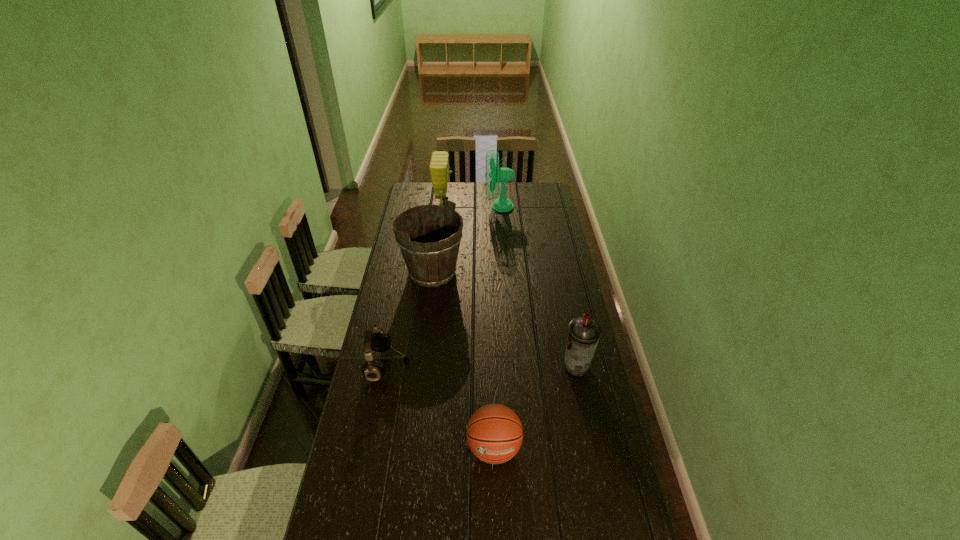
This screenshot has width=960, height=540. I want to click on free location located 0.050m on the face of the sponge, so click(x=462, y=203).

Locate an element on the screen. The width and height of the screenshot is (960, 540). free space located 0.360m on the left of the rightmost object is located at coordinates (471, 366).

The width and height of the screenshot is (960, 540). Identify the location of blank space located with the microphone on the side of the headset. (449, 366).

The height and width of the screenshot is (540, 960). Identify the location of vacant space located 0.180m on the logo side of the basketball. (496, 536).

Locate an element on the screen. fan at the far edge is located at coordinates (504, 175).

At what (x,y) coordinates should I click in order to perform the action: click on sponge positioned at the far edge. Please return your answer as a coordinate pair (x, y). The height and width of the screenshot is (540, 960). Looking at the image, I should click on (439, 166).

At what (x,y) coordinates should I click in order to perform the action: click on bucket at the left edge. Please return your answer as a coordinate pair (x, y). This screenshot has height=540, width=960. Looking at the image, I should click on (430, 263).

This screenshot has height=540, width=960. Identify the location of headset located at the left edge. (x=378, y=341).

I want to click on object that is at the right edge, so click(x=583, y=334).

Identify the location of vacant space at the left edge of the desktop. The width and height of the screenshot is (960, 540). (388, 281).